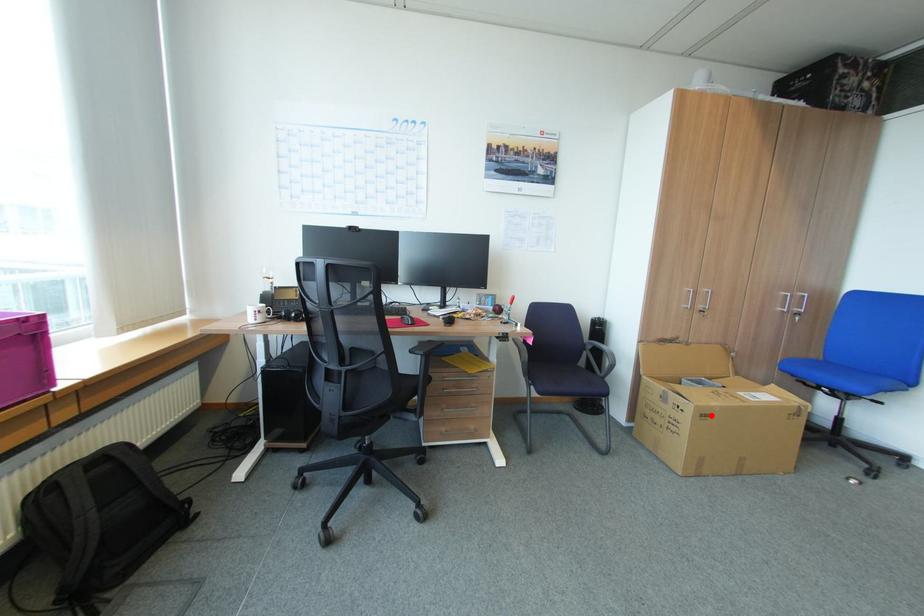
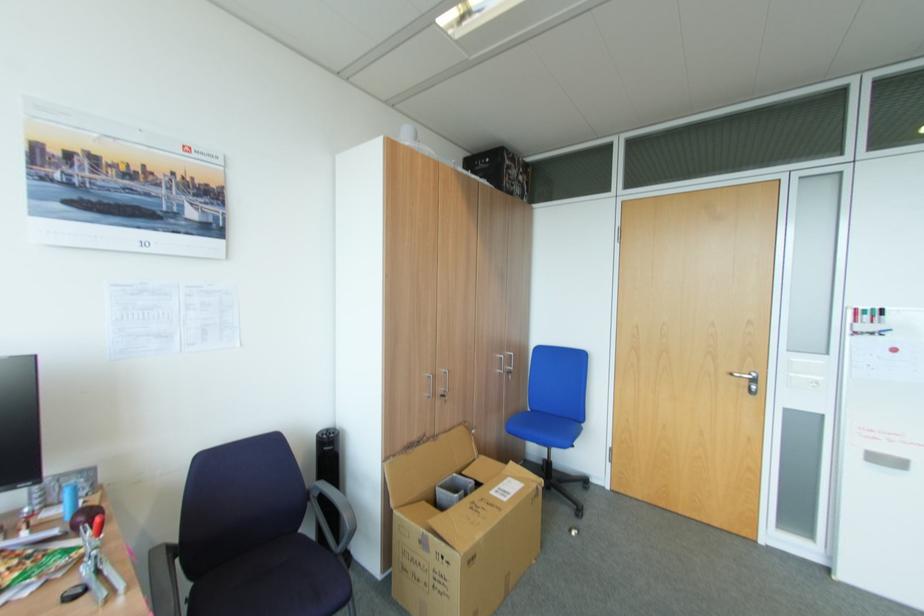
Find the pixel in the second image that matches the highlighted location in the first image.

(479, 556)